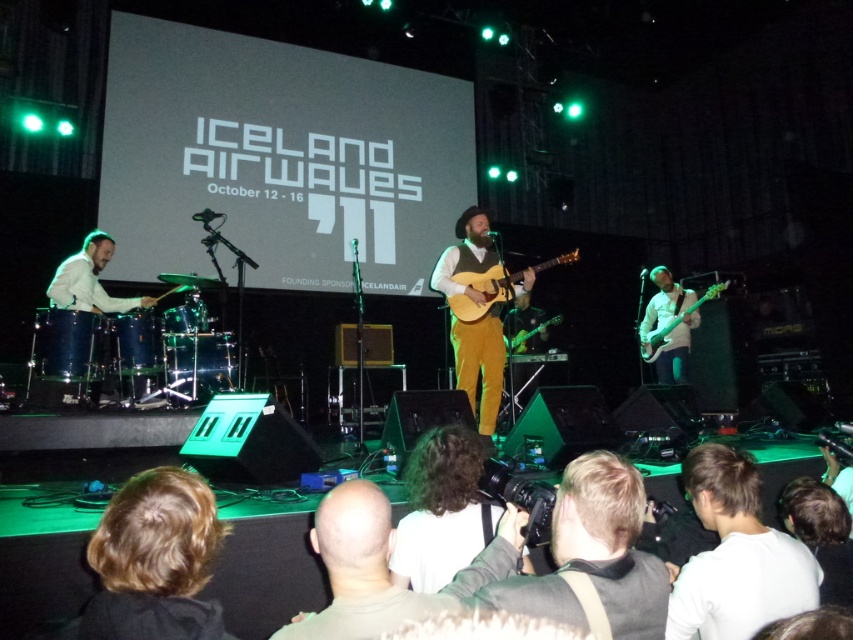
Question: Is white cotton shirt at lower right thinner than shiny black electric guitar at center?

Choices:
 (A) no
 (B) yes

Answer: (B)

Question: Observing the image, what is the correct spatial positioning of blonde hair at lower left in reference to bald head at center?

Choices:
 (A) right
 (B) left

Answer: (B)

Question: Which point is closer to the camera taking this photo?

Choices:
 (A) (694, 305)
 (B) (527, 333)
 (C) (479, 317)
 (D) (701, 582)

Answer: (D)

Question: Is bald head at center smaller than shiny black electric guitar at center?

Choices:
 (A) yes
 (B) no

Answer: (A)

Question: Estimate the real-world distances between objects in this image. Which object is farther from the green matte electric guitar at center?

Choices:
 (A) blonde hair at lower left
 (B) shiny black electric guitar at center

Answer: (A)

Question: Which of the following is the closest to the observer?

Choices:
 (A) mustard yellow fabric suit at center
 (B) shiny black electric guitar at center

Answer: (A)